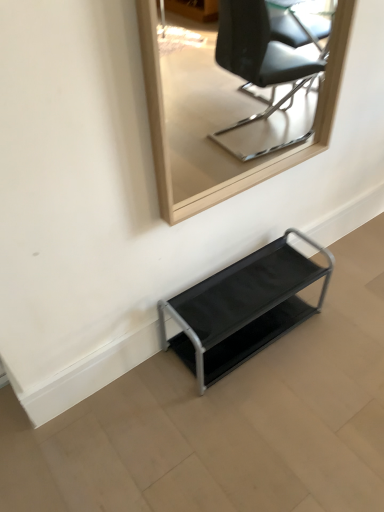
Describe the element at coordinates (242, 308) in the screenshot. Image resolution: width=384 pixels, height=512 pixels. I see `metallic gray shelf at lower center` at that location.

Where is `metallic gray shelf at lower center`? metallic gray shelf at lower center is located at coordinates (242, 308).

Measure the distance between point (297, 259) and camera.

1.60 meters.

You are a GUI agent. You are given a task and a screenshot of the screen. Output one action in this format:
    pyautogui.click(x=<x>, y=<y>)
    Task: Click on the wooden frame mirror at upper center
    The width and height of the screenshot is (384, 512).
    Given the screenshot: What is the action you would take?
    pyautogui.click(x=234, y=101)

This screenshot has width=384, height=512. Describe the element at coordinates (234, 101) in the screenshot. I see `wooden frame mirror at upper center` at that location.

Find the location of a particular element. The image size is (384, 512). metallic gray shelf at lower center is located at coordinates (242, 308).

Is metallic gray shelf at lower center to the right of wooden frame mirror at upper center from the viewer's perspective?

Correct, you'll find metallic gray shelf at lower center to the right of wooden frame mirror at upper center.

Considering the positions of objects metallic gray shelf at lower center and wooden frame mirror at upper center in the image provided, who is in front, metallic gray shelf at lower center or wooden frame mirror at upper center?

wooden frame mirror at upper center.

Which is behind, point (260, 262) or point (249, 42)?

The point (249, 42) is farther from the camera.

From the image's perspective, is metallic gray shelf at lower center over wooden frame mirror at upper center?

No, from the image's perspective, metallic gray shelf at lower center is not on top of wooden frame mirror at upper center.

From a real-world perspective, is metallic gray shelf at lower center above or below wooden frame mirror at upper center?

metallic gray shelf at lower center is below wooden frame mirror at upper center.

Which object is thinner, metallic gray shelf at lower center or wooden frame mirror at upper center?

Thinner between the two is wooden frame mirror at upper center.

Does metallic gray shelf at lower center have a greater height compared to wooden frame mirror at upper center?

No.

Can you confirm if metallic gray shelf at lower center is bigger than wooden frame mirror at upper center?

Indeed, metallic gray shelf at lower center has a larger size compared to wooden frame mirror at upper center.

Would you say wooden frame mirror at upper center is part of metallic gray shelf at lower center's contents?

No, wooden frame mirror at upper center is located outside of metallic gray shelf at lower center.

Is metallic gray shelf at lower center touching wooden frame mirror at upper center?

metallic gray shelf at lower center is not next to wooden frame mirror at upper center, and they're not touching.

Consider the image. Is metallic gray shelf at lower center facing away from wooden frame mirror at upper center?

No, metallic gray shelf at lower center is not facing the opposite direction of wooden frame mirror at upper center.

Where is `mirror above the metallic gray shelf at lower center (from the image's perspective)`? This screenshot has width=384, height=512. mirror above the metallic gray shelf at lower center (from the image's perspective) is located at coordinates (234, 101).

Which is more to the left, wooden frame mirror at upper center or metallic gray shelf at lower center?

Positioned to the left is wooden frame mirror at upper center.

Considering their positions, is wooden frame mirror at upper center located in front of or behind metallic gray shelf at lower center?

wooden frame mirror at upper center is in front of metallic gray shelf at lower center.

Which is nearer, (189, 109) or (325, 253)?

Clearly, point (189, 109) is more distant from the camera than point (325, 253).

From the image's perspective, which object appears higher, wooden frame mirror at upper center or metallic gray shelf at lower center?

wooden frame mirror at upper center.

From a real-world perspective, who is located lower, wooden frame mirror at upper center or metallic gray shelf at lower center?

From a 3D spatial view, metallic gray shelf at lower center is below.

Does wooden frame mirror at upper center have a greater width compared to metallic gray shelf at lower center?

No.

Which of these two, wooden frame mirror at upper center or metallic gray shelf at lower center, stands taller?

Standing taller between the two is wooden frame mirror at upper center.

Who is smaller, wooden frame mirror at upper center or metallic gray shelf at lower center?

With smaller size is wooden frame mirror at upper center.

Is wooden frame mirror at upper center positioned beyond the bounds of metallic gray shelf at lower center?

Yes.

Is wooden frame mirror at upper center far away from metallic gray shelf at lower center?

wooden frame mirror at upper center is far away from metallic gray shelf at lower center.

Is wooden frame mirror at upper center positioned with its back to metallic gray shelf at lower center?

wooden frame mirror at upper center is not turned away from metallic gray shelf at lower center.

The height and width of the screenshot is (512, 384). Find the location of `mirror on the left of the metallic gray shelf at lower center`. mirror on the left of the metallic gray shelf at lower center is located at coordinates (234, 101).

The height and width of the screenshot is (512, 384). I want to click on mirror above the metallic gray shelf at lower center (from the image's perspective), so [x=234, y=101].

I want to click on mirror on the left of metallic gray shelf at lower center, so [234, 101].